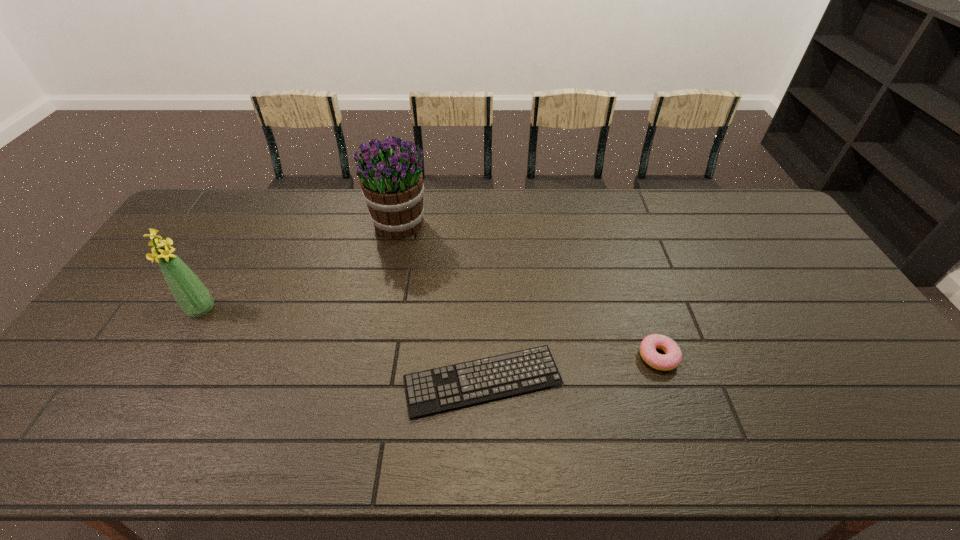
Identify the location of free space between the nearer bouquet and the computer keyboard. The height and width of the screenshot is (540, 960). (342, 345).

I want to click on vacant region between the rightmost object and the right bouquet, so click(x=529, y=290).

At what (x,y) coordinates should I click in order to perform the action: click on vacant point located between the computer keyboard and the farther bouquet. Please return your answer as a coordinate pair (x, y). The height and width of the screenshot is (540, 960). Looking at the image, I should click on (441, 302).

You are a GUI agent. You are given a task and a screenshot of the screen. Output one action in this format:
    pyautogui.click(x=<x>, y=<y>)
    Task: Click on the vacant space that is in between the farther bouquet and the shortest object
    
    Given the screenshot: What is the action you would take?
    pyautogui.click(x=441, y=302)

Locate an element on the screen. The width and height of the screenshot is (960, 540). vacant area between the second shortest object and the left bouquet is located at coordinates (430, 333).

The width and height of the screenshot is (960, 540). I want to click on free spot between the shortest object and the right bouquet, so click(441, 302).

In order to click on vacant space in between the shortest object and the rightmost object in this screenshot , I will do `click(570, 369)`.

Locate an element on the screen. The width and height of the screenshot is (960, 540). the closest object relative to the right bouquet is located at coordinates (444, 388).

I want to click on object that stands as the third closest to the shortest object, so click(x=192, y=296).

You are a GUI agent. You are given a task and a screenshot of the screen. Output one action in this format:
    pyautogui.click(x=<x>, y=<y>)
    Task: Click on the blank area in the image that satisfies the following two spatial constraints: 1. on the front-facing side of the computer keyboard; 2. on the left side of the third nearest object
    
    Given the screenshot: What is the action you would take?
    pyautogui.click(x=160, y=381)